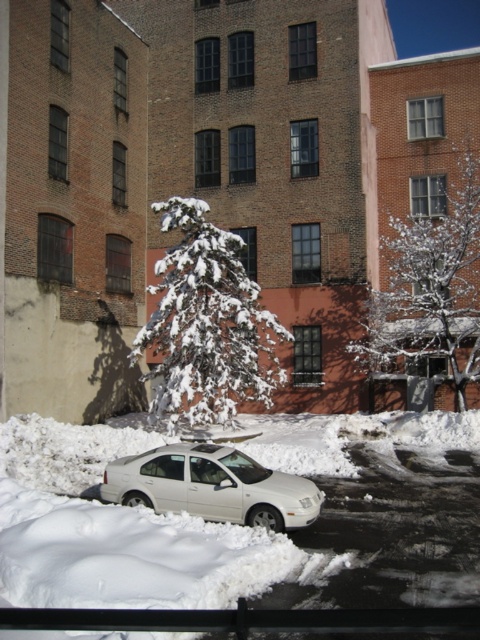
Which is in front, point (186, 358) or point (456, 148)?

Positioned in front is point (186, 358).

Identify the location of white snow-covered tree at center. (206, 323).

I want to click on white snow-covered tree at center, so click(x=206, y=323).

Is white snowy tree at center positioned in front of white matte car at center?

No, white snowy tree at center is further to the viewer.

Who is positioned more to the right, white snowy tree at center or white matte car at center?

white snowy tree at center

Is point (452, 294) positioned before point (156, 476)?

No, (452, 294) is behind (156, 476).

I want to click on white snowy tree at center, so click(430, 285).

Is white fluffy snow at center bigger than white snowy tree at center?

Indeed, white fluffy snow at center has a larger size compared to white snowy tree at center.

From the picture: Is white fluffy snow at center below white snowy tree at center?

Correct, white fluffy snow at center is located below white snowy tree at center.

You are a GUI agent. You are given a task and a screenshot of the screen. Output one action in this format:
    pyautogui.click(x=<x>, y=<y>)
    Task: Click on the white fluffy snow at center
    This screenshot has width=480, height=640.
    Given the screenshot: What is the action you would take?
    pyautogui.click(x=245, y=528)

Locate an element on the screen. The width and height of the screenshot is (480, 640). white fluffy snow at center is located at coordinates coord(245,528).